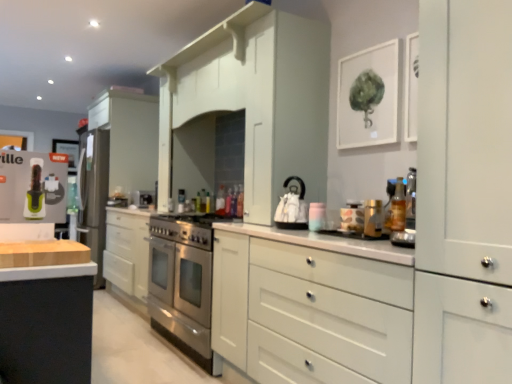
Question: Considering the positions of matte white jar at center, the first appliance when ordered from right to left, and white glossy kettle at center, the 2th appliance in the right-to-left sequence, in the image, is matte white jar at center, the first appliance when ordered from right to left, wider or thinner than white glossy kettle at center, the 2th appliance in the right-to-left sequence,?

Choices:
 (A) wide
 (B) thin

Answer: (B)

Question: From the image's perspective, relative to white glossy kettle at center, the 2th appliance in the front-to-back sequence, is matte white jar at center, the fourth appliance when ordered from left to right, above or below?

Choices:
 (A) below
 (B) above

Answer: (A)

Question: Which of these objects is positioned closest to the stainless steel gas stove at center?

Choices:
 (A) satin silver oven at center, marked as the 2th appliance in a back-to-front arrangement
 (B) wooden at left
 (C) white matte cabinet at center
 (D) matte white jar at center, the fourth appliance when ordered from left to right
 (E) satin silver refrigerator at left, which is the fourth appliance in front-to-back order

Answer: (C)

Question: Estimate the real-world distances between objects in this image. Which object is farther from the stainless steel gas stove at center?

Choices:
 (A) white glossy kettle at center, the third appliance viewed from the left
 (B) matte white jar at center, marked as the 1th appliance in a front-to-back arrangement
 (C) satin silver oven at center, marked as the 2th appliance in a back-to-front arrangement
 (D) wooden at left
 (E) green plastic appliance at left

Answer: (D)